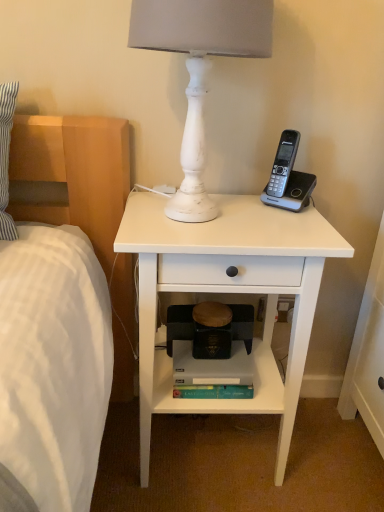
Identify the location of empty space that is ontop of gray matte bookshelf at lower center (from a real-world perspective). (207, 358).